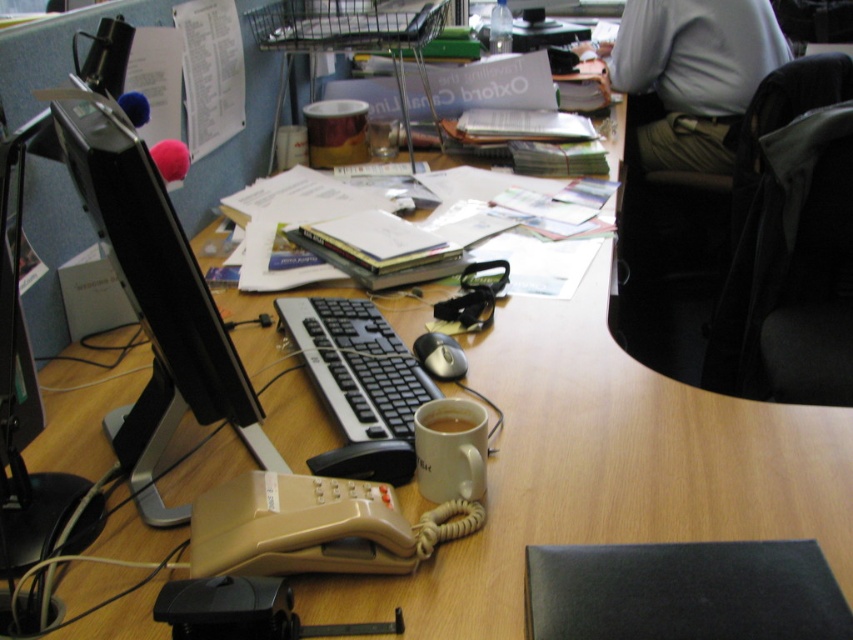
Can you confirm if white matte mug at center is taller than black plastic mouse at center?

Correct, white matte mug at center is much taller as black plastic mouse at center.

Is point (450, 496) positioned behind point (421, 358)?

No, (450, 496) is in front of (421, 358).

I want to click on white matte mug at center, so click(x=450, y=449).

This screenshot has width=853, height=640. Describe the element at coordinates (155, 285) in the screenshot. I see `black glossy monitor at left` at that location.

The height and width of the screenshot is (640, 853). In order to click on black glossy monitor at left in this screenshot , I will do `click(155, 285)`.

You are a GUI agent. You are given a task and a screenshot of the screen. Output one action in this format:
    pyautogui.click(x=<x>, y=<y>)
    Task: Click on the black glossy monitor at left
    
    Given the screenshot: What is the action you would take?
    pyautogui.click(x=155, y=285)

Who is higher up, gray fabric shirt at upper right or black plastic keyboard at center?

gray fabric shirt at upper right is higher up.

Between gray fabric shirt at upper right and black plastic keyboard at center, which one is positioned lower?

black plastic keyboard at center is below.

In the scene shown: Measure the distance between point (680, 58) and camera.

Point (680, 58) and camera are 8.37 feet apart from each other.

At what (x,y) coordinates should I click in order to perform the action: click on gray fabric shirt at upper right. Please return your answer as a coordinate pair (x, y). Looking at the image, I should click on (693, 74).